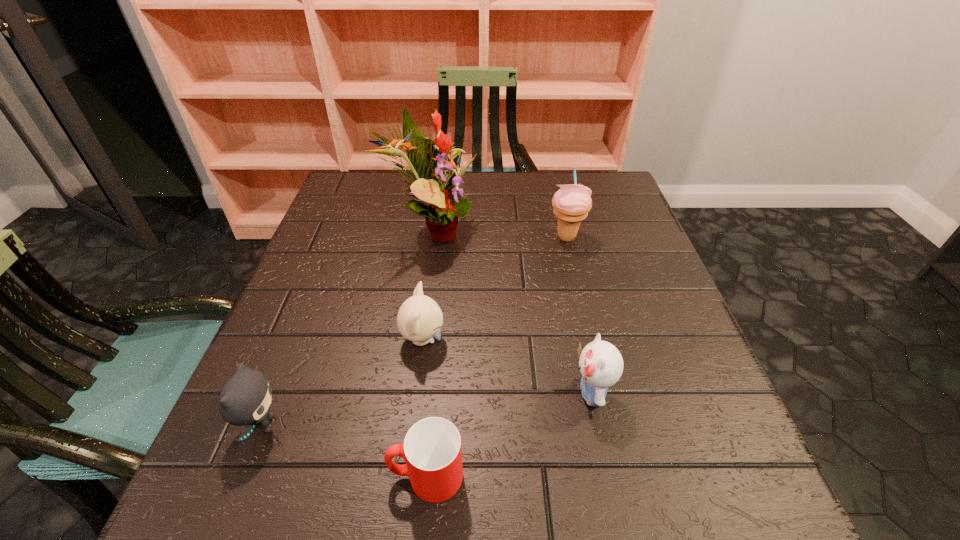
Identify the location of the tallest object. The width and height of the screenshot is (960, 540). (445, 203).

The height and width of the screenshot is (540, 960). Find the location of `icecream`. icecream is located at coordinates (571, 203).

At what (x,y) coordinates should I click in order to perform the action: click on the rightmost kitten. Please return your answer as a coordinate pair (x, y). Image resolution: width=960 pixels, height=540 pixels. Looking at the image, I should click on click(601, 365).

This screenshot has height=540, width=960. In order to click on the leftmost kitten in this screenshot , I will do `click(245, 399)`.

At what (x,y) coordinates should I click in order to perform the action: click on the second kitten from left to right. Please return your answer as a coordinate pair (x, y). The height and width of the screenshot is (540, 960). Looking at the image, I should click on (419, 319).

Locate an element on the screen. The image size is (960, 540). the fourth nearest object is located at coordinates (419, 319).

Where is `cup`? The width and height of the screenshot is (960, 540). cup is located at coordinates (432, 450).

Find the location of a particular element. vacant space situated 0.360m on the front-facing side of the tallest object is located at coordinates (624, 232).

In order to click on vacant space situated 0.120m on the left of the icecream in this screenshot , I will do point(499,237).

Where is `vacant space located on the front-facing side of the rightmost kitten`? This screenshot has width=960, height=540. vacant space located on the front-facing side of the rightmost kitten is located at coordinates (336, 393).